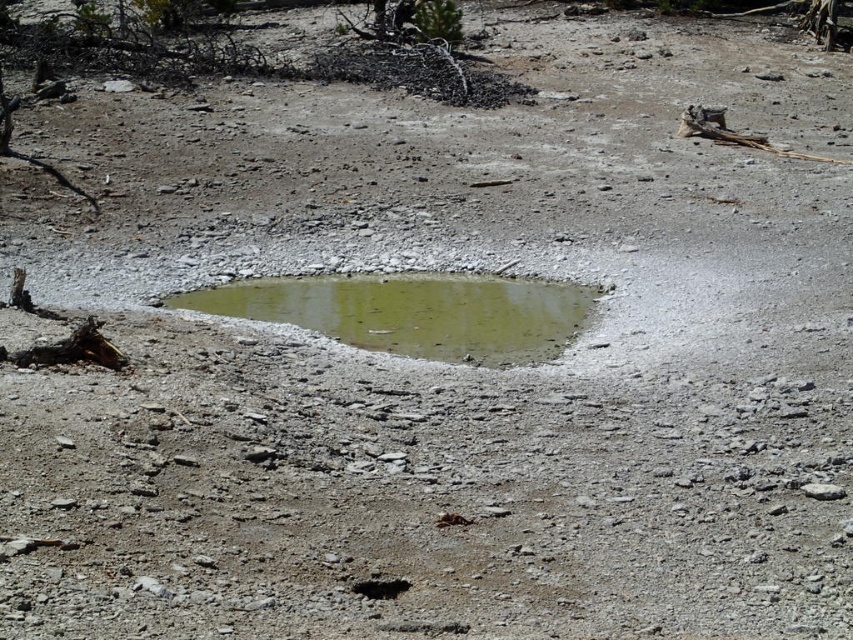
Is green mud puddle at center in front of dark brown dirt hole at center?

No, it is behind dark brown dirt hole at center.

Who is lower down, green mud puddle at center or dark brown dirt hole at center?

dark brown dirt hole at center is lower down.

Which is behind, point (206, 294) or point (375, 593)?

The point (206, 294) is behind.

Image resolution: width=853 pixels, height=640 pixels. Find the location of `green mud puddle at center`. green mud puddle at center is located at coordinates (415, 312).